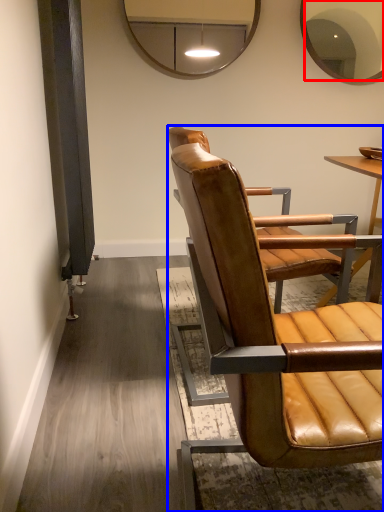
Question: Among these objects, which one is farthest to the camera, mirror (highlighted by a red box) or chair (highlighted by a blue box)?

Choices:
 (A) mirror
 (B) chair

Answer: (A)